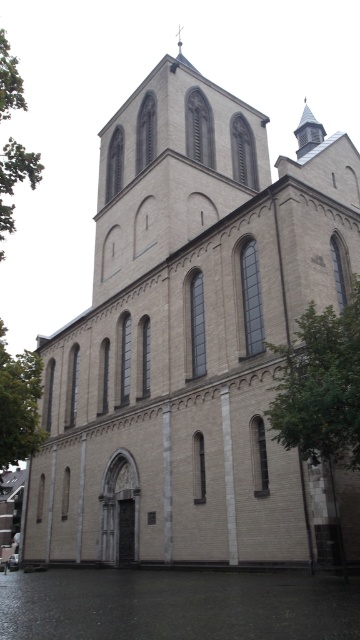
Is green leafy tree at right to the left of green leafy tree at lower left from the viewer's perspective?

Incorrect, green leafy tree at right is not on the left side of green leafy tree at lower left.

Does green leafy tree at right appear on the right side of green leafy tree at lower left?

Indeed, green leafy tree at right is positioned on the right side of green leafy tree at lower left.

What do you see at coordinates (321, 385) in the screenshot? The width and height of the screenshot is (360, 640). I see `green leafy tree at right` at bounding box center [321, 385].

This screenshot has height=640, width=360. What are the coordinates of `green leafy tree at right` in the screenshot? It's located at (321, 385).

Is the position of dark gray water at lower center less distant than that of green leafy tree at right?

Yes, dark gray water at lower center is closer to the viewer.

Looking at this image, can you confirm if dark gray water at lower center is bigger than green leafy tree at right?

Yes, dark gray water at lower center is bigger than green leafy tree at right.

Is point (231, 602) positioned after point (317, 460)?

No, (231, 602) is closer to viewer.

At what (x,y) coordinates should I click in order to perform the action: click on dark gray water at lower center. Please return your answer as a coordinate pair (x, y). This screenshot has width=360, height=640. Looking at the image, I should click on (177, 604).

Is green leafy tree at lower left wider than green leafy tree at left?

Incorrect, green leafy tree at lower left's width does not surpass green leafy tree at left's.

Does green leafy tree at lower left appear on the right side of green leafy tree at left?

Indeed, green leafy tree at lower left is positioned on the right side of green leafy tree at left.

Identify the location of green leafy tree at lower left. The image size is (360, 640). (19, 403).